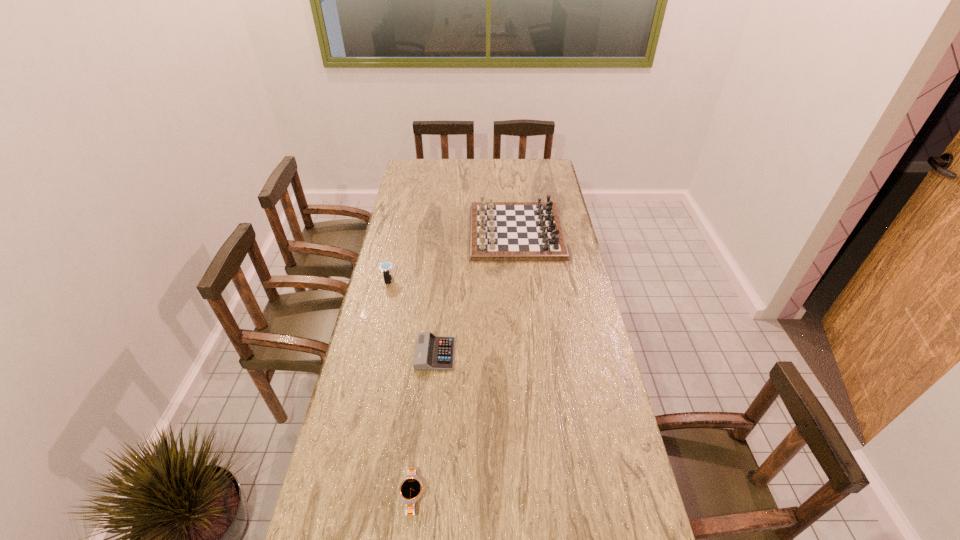
Image resolution: width=960 pixels, height=540 pixels. I want to click on vacant region between the farther watch and the calculator, so 412,317.

This screenshot has width=960, height=540. In order to click on vacant space that's between the right watch and the third farthest object in this screenshot , I will do `click(424, 425)`.

At what (x,y) coordinates should I click in order to perform the action: click on vacant point located between the leftmost object and the rightmost object. Please return your answer as a coordinate pair (x, y). The width and height of the screenshot is (960, 540). Looking at the image, I should click on (453, 256).

The width and height of the screenshot is (960, 540). Find the location of `free space between the chessboard and the right watch`. free space between the chessboard and the right watch is located at coordinates (465, 363).

Where is `free space between the calculator and the shorter watch`? The width and height of the screenshot is (960, 540). free space between the calculator and the shorter watch is located at coordinates (424, 425).

You are a GUI agent. You are given a task and a screenshot of the screen. Output one action in this format:
    pyautogui.click(x=<x>, y=<y>)
    Task: Click on the vacant area between the second nearest object and the farthest object
    
    Given the screenshot: What is the action you would take?
    pyautogui.click(x=476, y=293)

Locate an element on the screen. The width and height of the screenshot is (960, 540). free spot between the calculator and the taller watch is located at coordinates (412, 317).

I want to click on vacant space in between the rightmost object and the calculator, so [x=476, y=293].

This screenshot has height=540, width=960. Find the location of `the second closest object to the second farthest object`. the second closest object to the second farthest object is located at coordinates (499, 231).

Identify which object is located as the nearest to the nearest object. Please provide its 2D coordinates. Your answer should be formatted as a tuple, i.e. [(x, y)], where the tuple contains the x and y coordinates of a point satisfying the conditions above.

[(432, 352)]